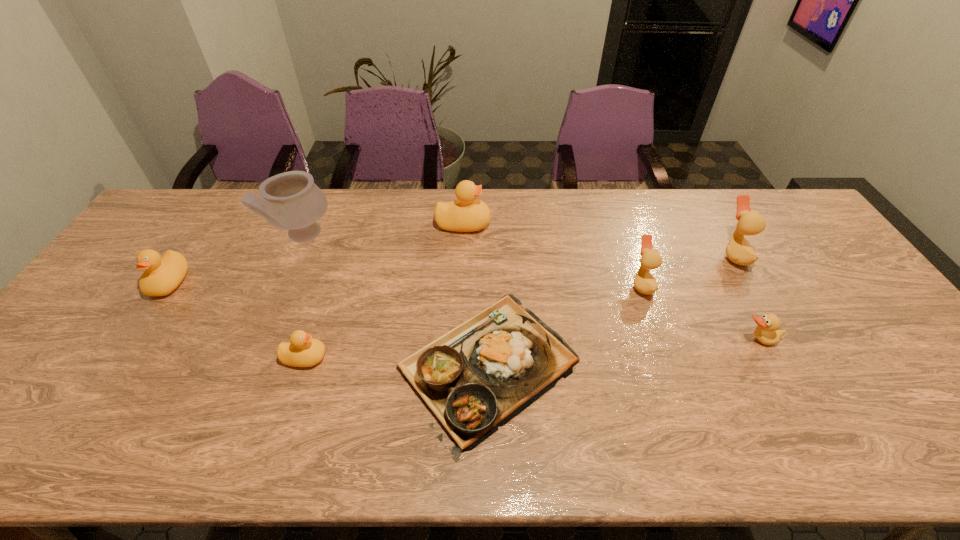
The width and height of the screenshot is (960, 540). In order to click on brown pottery in this screenshot , I will do `click(291, 200)`.

You are a GUI agent. You are given a task and a screenshot of the screen. Output one action in this format:
    pyautogui.click(x=<x>, y=<y>)
    Task: Click on the tallest object
    
    Given the screenshot: What is the action you would take?
    pyautogui.click(x=291, y=200)

The image size is (960, 540). Find the location of `the biggest yellow duck`. the biggest yellow duck is located at coordinates (465, 214).

Locate an element on the screen. The width and height of the screenshot is (960, 540). the rightmost yellow duck is located at coordinates (465, 214).

At what (x,y) coordinates should I click in order to perform the action: click on the biggest tan duck. Please return your answer as a coordinate pair (x, y). This screenshot has height=540, width=960. Looking at the image, I should click on (738, 250).

Where is `the second nearest yellow duck`? the second nearest yellow duck is located at coordinates (162, 275).

Locate an element on the screen. the second smallest yellow duck is located at coordinates (162, 275).

The image size is (960, 540). I want to click on the leftmost tan duck, so click(644, 282).

Locate an element on the screen. The height and width of the screenshot is (540, 960). the third duck from right to left is located at coordinates (644, 282).

Identify the location of the smallest yellow duck. The image size is (960, 540). (302, 351).